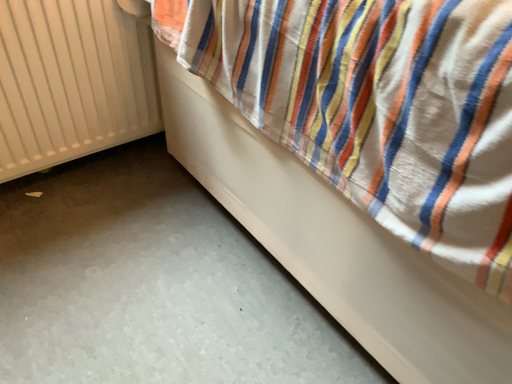
At what (x,y) coordinates should I click in order to perform the action: click on vacant space underneath white matte radiator at left (from a real-world perspective). Please return your answer as a coordinate pair (x, y). The width and height of the screenshot is (512, 384). Looking at the image, I should click on (75, 167).